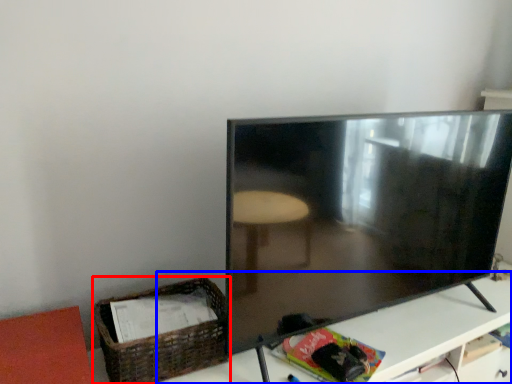
Question: Which point is further to the camera, basket (highlighted by a red box) or table (highlighted by a blue box)?

Choices:
 (A) basket
 (B) table

Answer: (A)